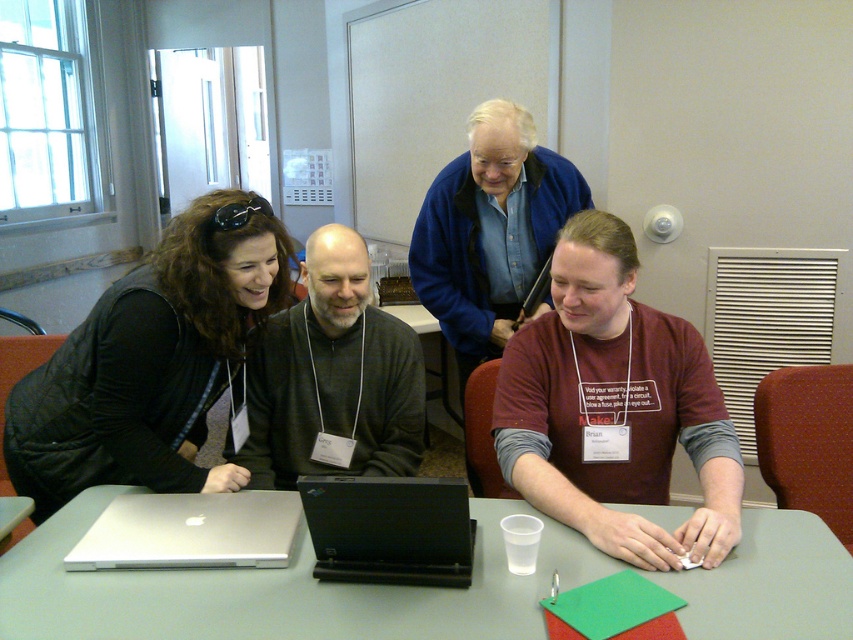
Who is higher up, matte black jacket at left or blue wool sweater at upper center?

blue wool sweater at upper center

Does matte black jacket at left appear on the left side of blue wool sweater at upper center?

Correct, you'll find matte black jacket at left to the left of blue wool sweater at upper center.

Is point (70, 451) farther from camera compared to point (506, 284)?

No, it is in front of (506, 284).

Locate an element on the screen. This screenshot has width=853, height=640. matte black jacket at left is located at coordinates (144, 364).

Can you confirm if smooth gray table at center is thinner than black plastic laptop at center?

In fact, smooth gray table at center might be wider than black plastic laptop at center.

Does smooth gray table at center appear over black plastic laptop at center?

Actually, smooth gray table at center is below black plastic laptop at center.

Does point (782, 627) lie in front of point (463, 504)?

Yes, it is in front of point (463, 504).

At what (x,y) coordinates should I click in order to perform the action: click on smooth gray table at center. Please return your answer as a coordinate pair (x, y). Looking at the image, I should click on (279, 589).

Does maroon cotton shirt at center have a greater width compared to silver metallic laptop at center?

Indeed, maroon cotton shirt at center has a greater width compared to silver metallic laptop at center.

This screenshot has width=853, height=640. Identify the location of maroon cotton shirt at center. (614, 408).